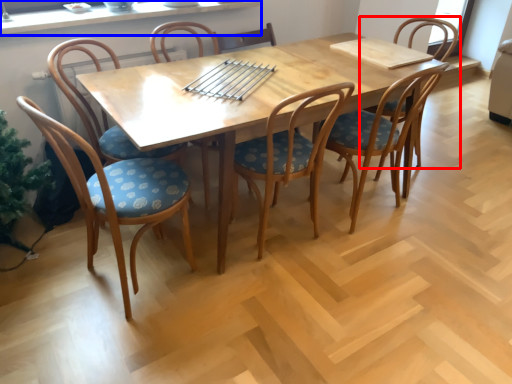
Question: Which object is closer to the camera taking this photo, chair (highlighted by a red box) or window sill (highlighted by a blue box)?

Choices:
 (A) chair
 (B) window sill

Answer: (B)